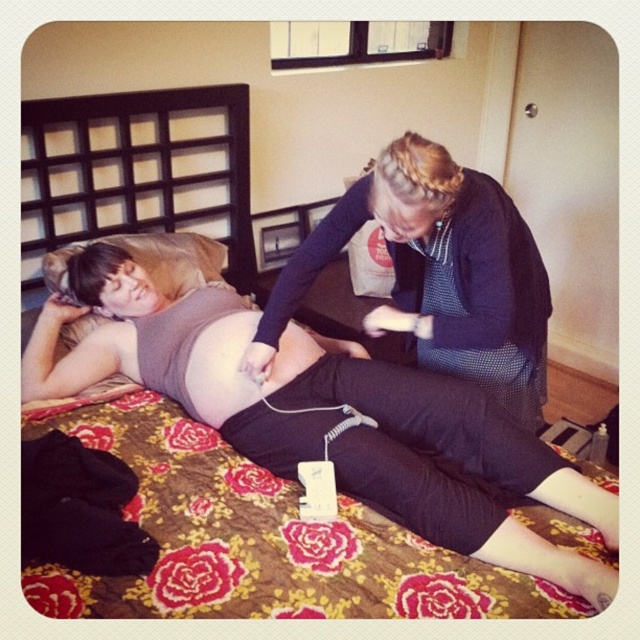
You are a photographer setting up a shoot in this room. You need to position a small tripod between the dark blue textured sweater at upper center and the brown fabric pillow at upper left. Based on their heights, which object should the tripod be placed closer to to ensure stability?

The dark blue textured sweater at upper center is taller than the brown fabric pillow at upper left. To ensure stability, the tripod should be placed closer to the dark blue textured sweater at upper center since it has a higher center of gravity.

You are a photographer setting up a shoot in this room. You need to position a small lamp so that it illuminates both the dark blue textured sweater at upper center and the matte skin at center without casting harsh shadows. Based on their positions, where should you place the lamp relative to these two objects?

The dark blue textured sweater at upper center is on the right side of matte skin at center. To avoid harsh shadows, place the lamp to the left of the matte skin at center, which would be the left side of the dark blue textured sweater at upper center, ensuring both receive even lighting.